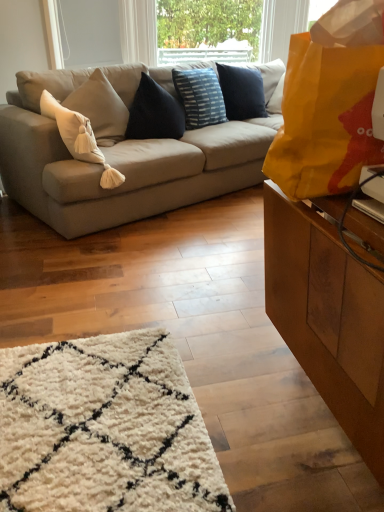
Question: In the image, is beige fabric couch at center on the left side or the right side of yellow paper bag at right?

Choices:
 (A) right
 (B) left

Answer: (B)

Question: Is beige fabric couch at center in front of or behind yellow paper bag at right in the image?

Choices:
 (A) behind
 (B) front

Answer: (A)

Question: Which object is positioned farthest from the white soft cushion at left, positioned as the 2th pillow in right-to-left order?

Choices:
 (A) yellow paper bag at right
 (B) blue striped cushion at center, the 1th pillow positioned from the right
 (C) beige fabric couch at center

Answer: (A)

Question: Which object is the farthest from the white soft cushion at left, the first pillow viewed from the front?

Choices:
 (A) blue striped cushion at center, which is the 2th pillow from left to right
 (B) yellow paper bag at right
 (C) beige fabric couch at center

Answer: (B)